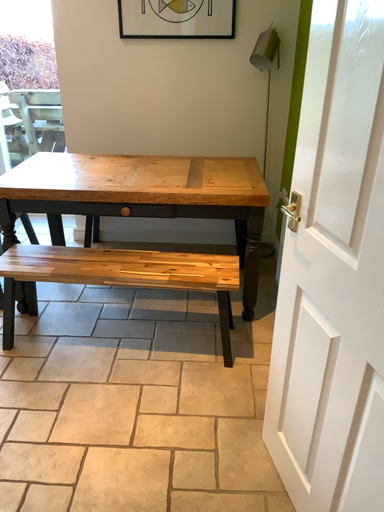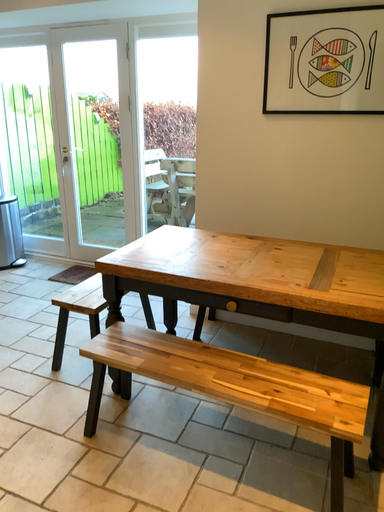
Question: Which way did the camera rotate in the video?

Choices:
 (A) rotated right
 (B) rotated left

Answer: (B)